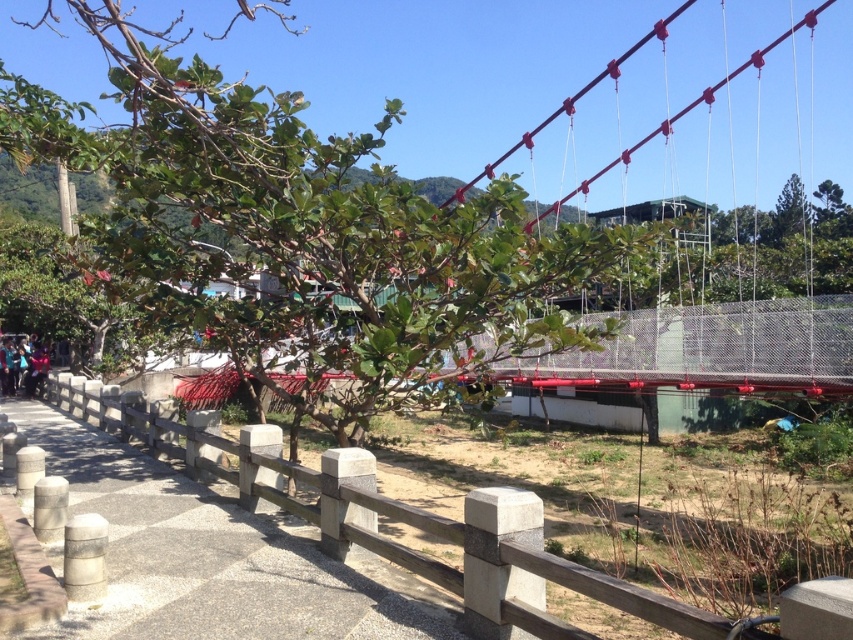
Does green leafy tree at center have a smaller size compared to gray concrete fence at center?

Incorrect, green leafy tree at center is not smaller in size than gray concrete fence at center.

Between green leafy tree at center and gray concrete fence at center, which one has less height?

gray concrete fence at center is shorter.

Describe the element at coordinates (309, 227) in the screenshot. The height and width of the screenshot is (640, 853). I see `green leafy tree at center` at that location.

At what (x,y) coordinates should I click in order to perform the action: click on green leafy tree at center. Please return your answer as a coordinate pair (x, y). Looking at the image, I should click on (309, 227).

Is gray concrete fence at center to the right of blue denim jacket at lower left from the viewer's perspective?

Correct, you'll find gray concrete fence at center to the right of blue denim jacket at lower left.

Does point (412, 570) come closer to viewer compared to point (30, 368)?

Yes.

Find the location of a particular element. This screenshot has height=640, width=853. gray concrete fence at center is located at coordinates (373, 513).

From the picture: Between green leafy tree at center and blue denim jacket at lower left, which one has more height?

green leafy tree at center is taller.

Is green leafy tree at center to the right of blue denim jacket at lower left from the viewer's perspective?

Indeed, green leafy tree at center is positioned on the right side of blue denim jacket at lower left.

Does point (242, 13) come behind point (26, 392)?

Yes, point (242, 13) is farther from viewer.

Where is `green leafy tree at center`? This screenshot has width=853, height=640. green leafy tree at center is located at coordinates (309, 227).